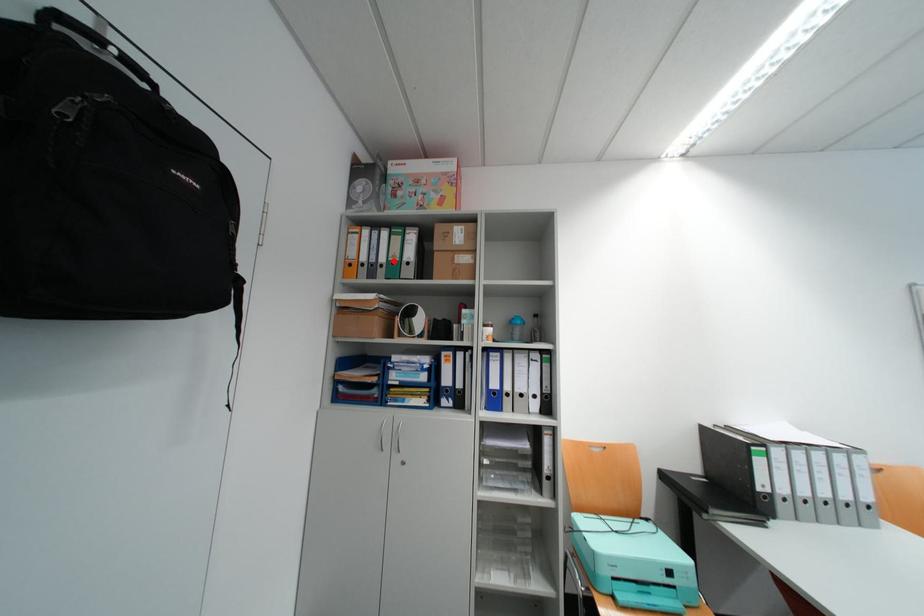
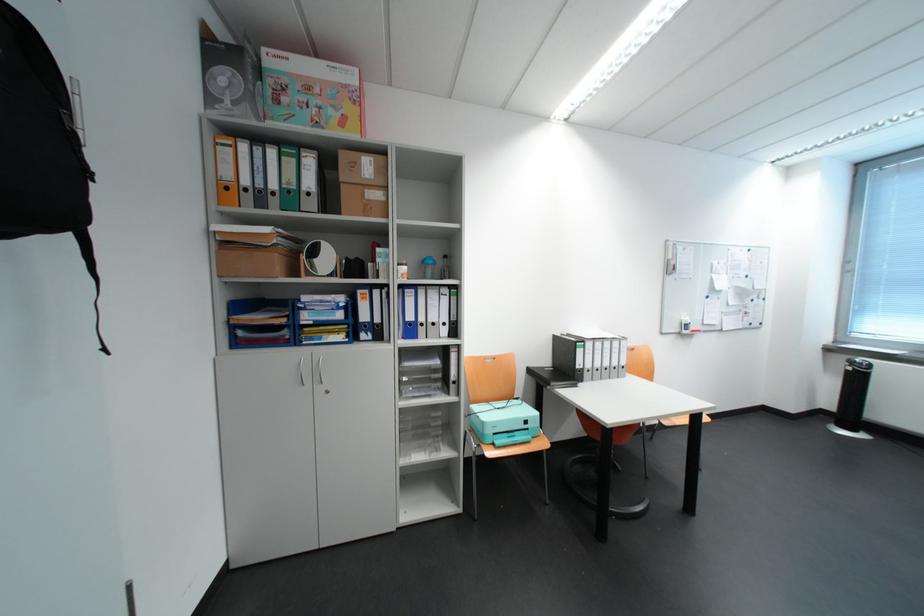
Question: I am providing you with two images of the same scene from different viewpoints. A red point is marked on the first image. At the location where the point appears in image 1, is it still visible in image 2?

Choices:
 (A) Yes
 (B) No

Answer: (A)